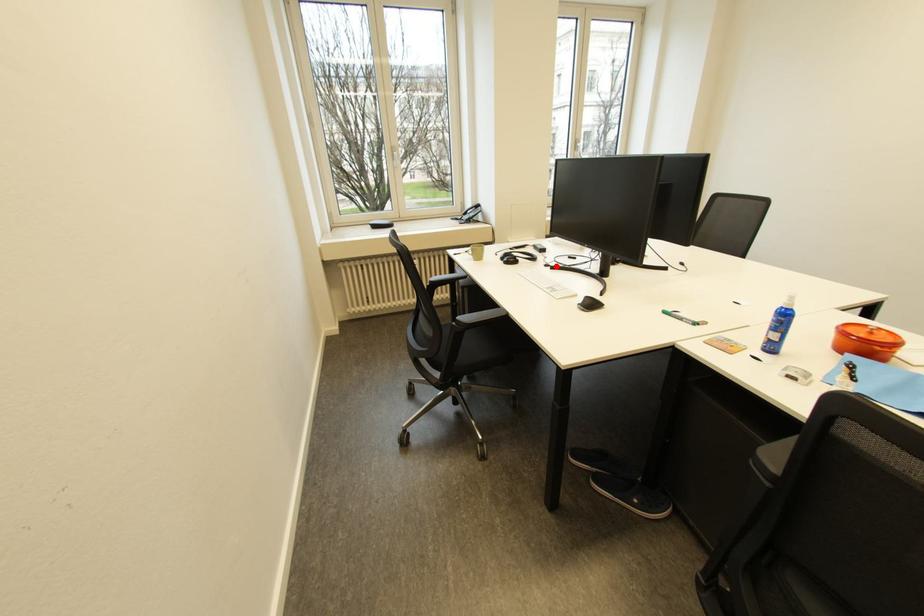
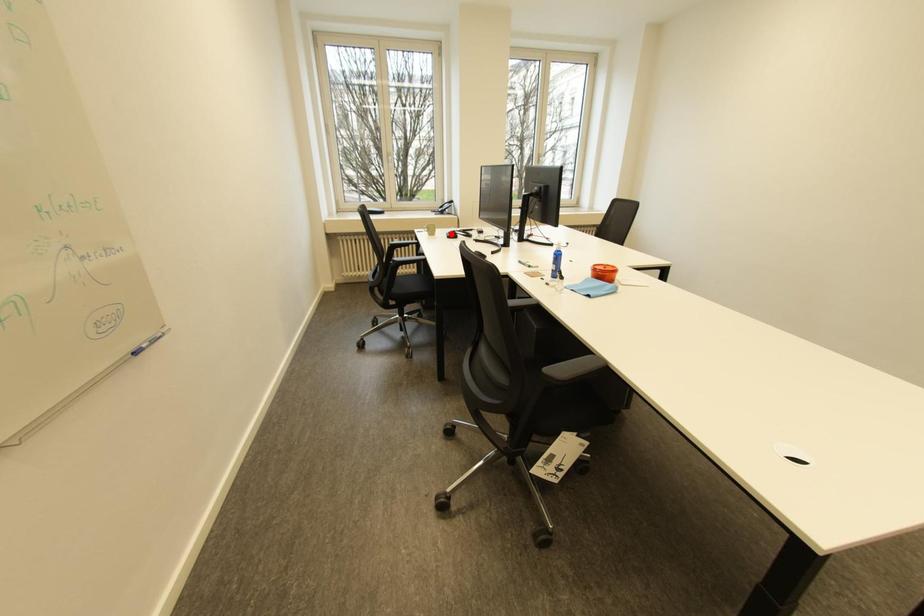
I am providing you with two images of the same scene from different viewpoints. A red point is marked on the first image and another point is marked on the second image. Is the marked point in image1 the same physical position as the marked point in image2?

No